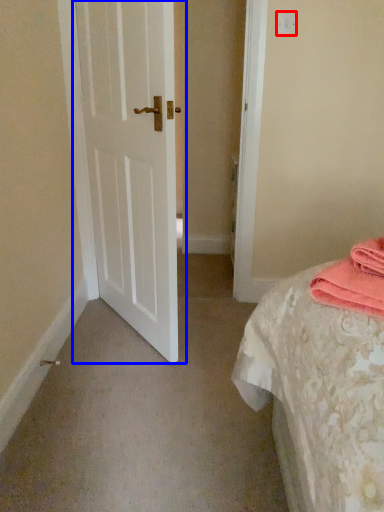
Question: Which of the following is the closest to the observer, light switch (highlighted by a red box) or door (highlighted by a blue box)?

Choices:
 (A) light switch
 (B) door

Answer: (B)